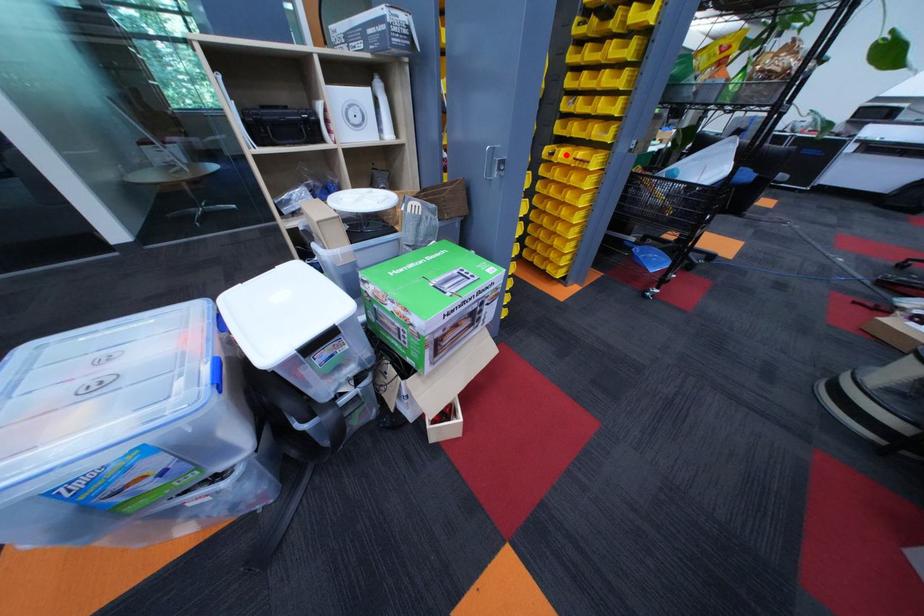
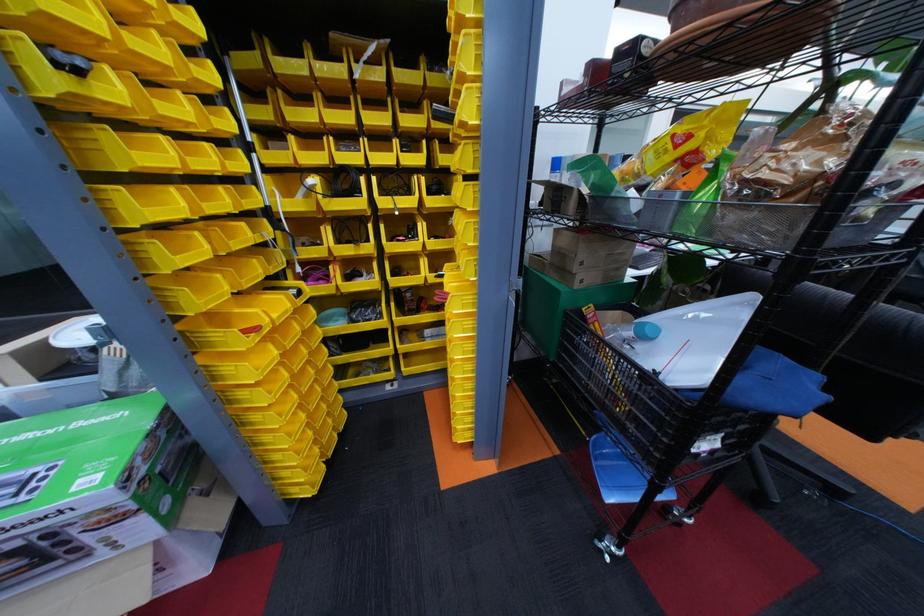
Question: I am providing you with two images of the same scene from different viewpoints. A red point is shown in image1. For the corresponding object point in image2, is it positioned nearer or farther from the camera?

Choices:
 (A) Nearer
 (B) Farther

Answer: (B)